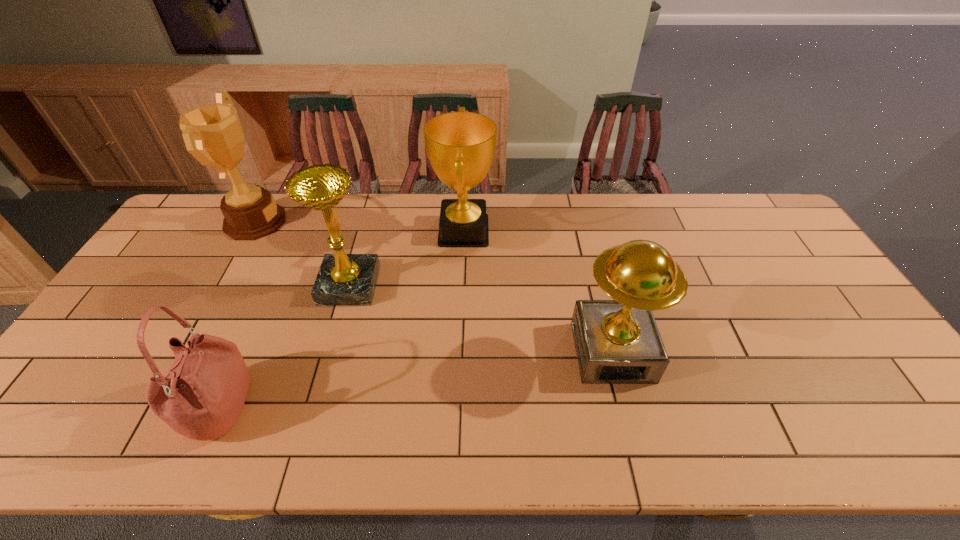
Identify the location of blank region between the third award from left to right and the handbag. (342, 320).

Locate an element on the screen. This screenshot has height=540, width=960. vacant area that lies between the rightmost object and the third farthest award is located at coordinates (481, 319).

Locate an element on the screen. Image resolution: width=960 pixels, height=540 pixels. free space between the handbag and the leftmost award is located at coordinates (237, 315).

This screenshot has width=960, height=540. What are the coordinates of `unoccupied area between the second award from left to right and the rightmost object` in the screenshot? It's located at (481, 319).

You are a GUI agent. You are given a task and a screenshot of the screen. Output one action in this format:
    pyautogui.click(x=<x>, y=<y>)
    Task: Click on the free space between the leftmost award and the handbag
    
    Given the screenshot: What is the action you would take?
    pyautogui.click(x=237, y=315)

Find the location of a particular element. vacant space in between the third award from left to right and the handbag is located at coordinates (342, 320).

You are a GUI agent. You are given a task and a screenshot of the screen. Output one action in this format:
    pyautogui.click(x=<x>, y=<y>)
    Task: Click on the free spot between the rightmost object and the leftmost award
    This screenshot has height=540, width=960.
    Given the screenshot: What is the action you would take?
    pyautogui.click(x=434, y=287)

Locate an element on the screen. free space between the third award from left to right and the rightmost object is located at coordinates (538, 292).

This screenshot has height=540, width=960. I want to click on vacant area that lies between the third object from left to right and the leftmost award, so click(302, 253).

Image resolution: width=960 pixels, height=540 pixels. In order to click on object that can be found as the second closest to the rightmost award in this screenshot , I will do `click(343, 279)`.